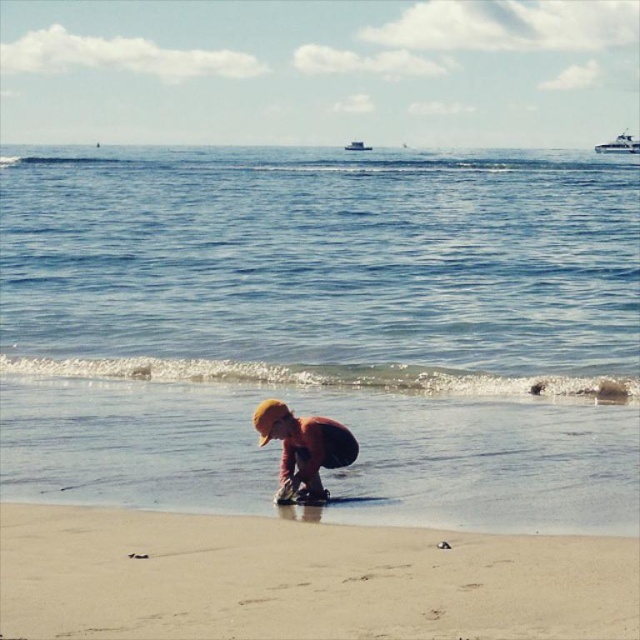
You are standing at the point with coordinates (304, 449) on the beach. What object is located at this point?

The point at (304, 449) indicates the orange fabric boy at center.

You are a photographer trying to capture the entire scene of the orange fabric boy at center and the white glossy boat at upper right in one shot. Based on their sizes, which object would appear smaller in the photograph?

The orange fabric boy at center would appear smaller in the photograph because its width is less than the white glossy boat at upper right.